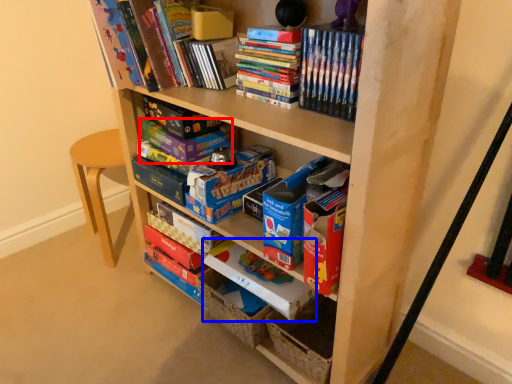
Question: Which object appears farthest to the camera in this image, paperback book (highlighted by a red box) or paperback book (highlighted by a blue box)?

Choices:
 (A) paperback book
 (B) paperback book

Answer: (A)